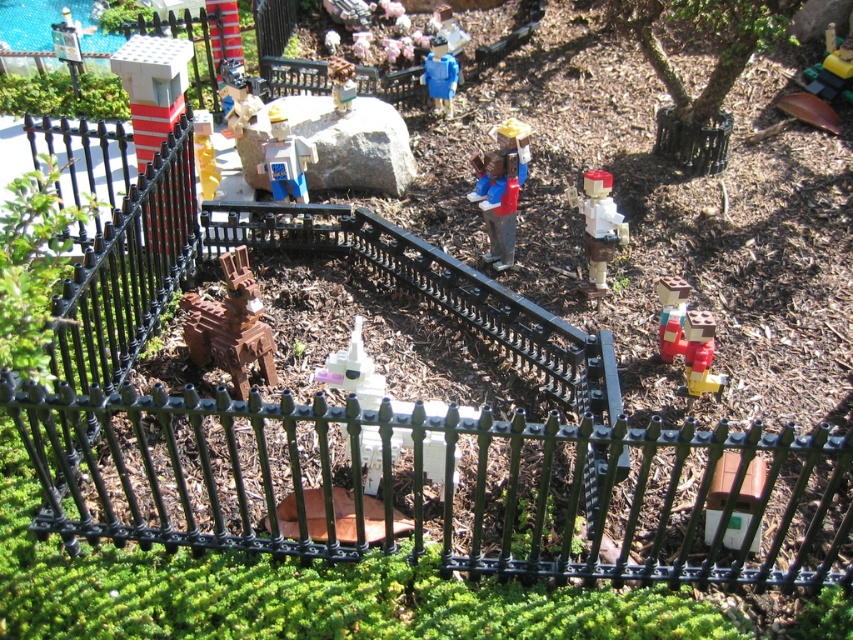
In the scene shown: Can you confirm if brown wooden horse at center is shorter than matte blue figure at center?

In fact, brown wooden horse at center may be taller than matte blue figure at center.

Image resolution: width=853 pixels, height=640 pixels. Describe the element at coordinates (230, 324) in the screenshot. I see `brown wooden horse at center` at that location.

Describe the element at coordinates (230, 324) in the screenshot. This screenshot has width=853, height=640. I see `brown wooden horse at center` at that location.

What are the coordinates of `brown wooden horse at center` in the screenshot? It's located at (230, 324).

Between point (607, 212) and point (334, 60), which one is positioned in front?

Point (607, 212)

Does white matte figure at center-right have a lesser width compared to white plastic unicorn at center?

No, white matte figure at center-right is not thinner than white plastic unicorn at center.

In order to click on white matte figure at center-right in this screenshot , I will do `click(596, 227)`.

Does smooth brown figure at center have a lesser height compared to brick red plastic figure at lower right?

No, smooth brown figure at center is not shorter than brick red plastic figure at lower right.

Does smooth brown figure at center appear over brick red plastic figure at lower right?

Yes, smooth brown figure at center is above brick red plastic figure at lower right.

Describe the element at coordinates (502, 188) in the screenshot. I see `smooth brown figure at center` at that location.

At what (x,y) coordinates should I click in order to perform the action: click on smooth brown figure at center. Please return your answer as a coordinate pair (x, y). Looking at the image, I should click on (502, 188).